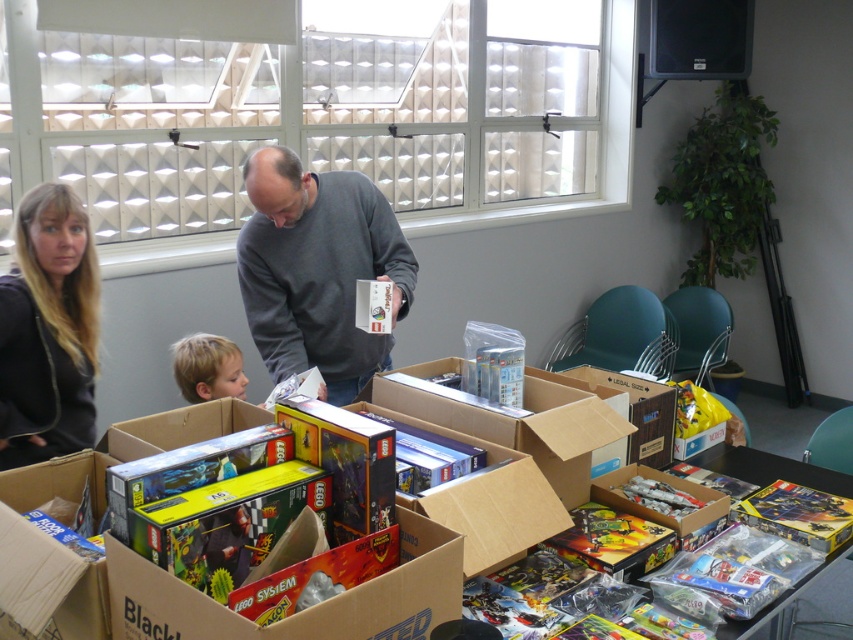
You are a delivery person who needs to place a new LEGO box on the table. The new box is 1.2 meters wide. Looking at the scene, can the cardboard box at center and the blonde hair at lower left fit side by side on a table that is 2.5 meters wide?

The cardboard box at center might be wider than blonde hair at lower left. However, without knowing the exact widths, it is uncertain if their combined width would exceed 2.5 meters. The delivery person should measure both objects first.

You are a person standing in the room. You want to know what is at the center of the room. What is located at the point with coordinates (x=318, y=269)?

The point at coordinates (x=318, y=269) corresponds to the gray matte shirt at center.